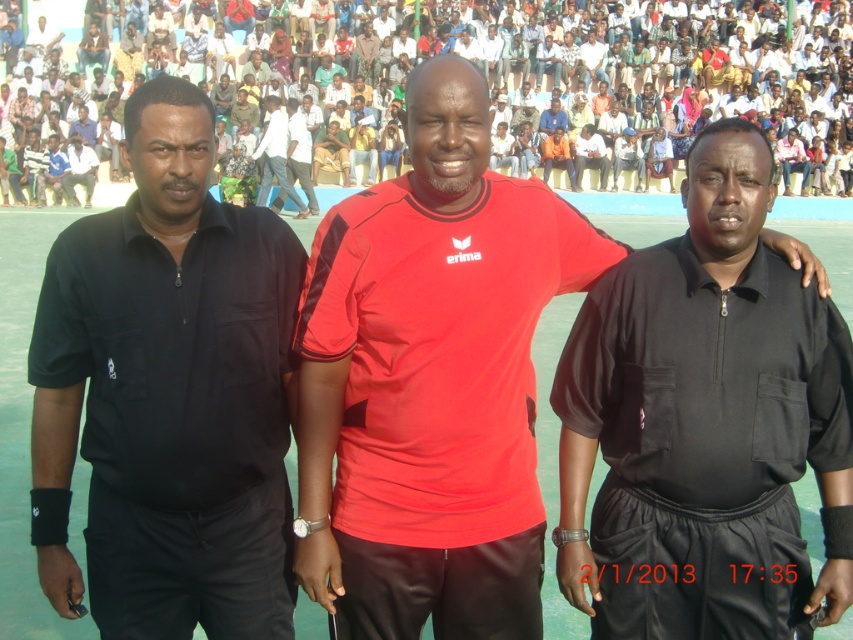
You are a photographer at the event and want to capture a photo that includes both the black matte shirt at left and the light blue jeans at center. Based on their positions, where should you position the camera to ensure both are visible in the frame?

Since the black matte shirt at left is located below the light blue jeans at center, you should position the camera at a lower angle to capture both the black matte shirt at left and the light blue jeans at center in the frame.

You are a photographer at the event and want to take a photo that includes both the point at (61, 284) and the point at (265, 164). Which point should you focus on first to ensure both are in sharp focus?

You should focus on point (61, 284) first because it is closer to the viewer than point (265, 164), ensuring both are within the depth of field.

You are organizing a team photo and need to arrange the black matte shirt at left and light blue jeans at center side by side. Based on their sizes, which one should be placed on the left to ensure they both fit within a 2m wide frame?

The black matte shirt at left has a smaller width than the light blue jeans at center, so placing the black matte shirt at left on the left side and the light blue jeans at center on the right side would ensure both fit within the 2m wide frame since their combined widths are less than 2m.